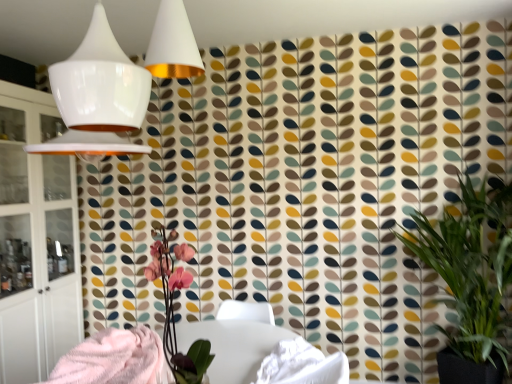
What do you see at coordinates (97, 96) in the screenshot? I see `white glossy lampshade at upper left` at bounding box center [97, 96].

Where is `white glass cabinet at left`? Image resolution: width=512 pixels, height=384 pixels. white glass cabinet at left is located at coordinates (36, 241).

Find the location of a particular element. The width and height of the screenshot is (512, 384). white glossy lampshade at upper left is located at coordinates (97, 96).

Between pink matte orchid at center and white glossy lampshade at upper left, which one has smaller size?

With smaller size is pink matte orchid at center.

Identify the location of floral arrangement lying on the right of white glossy lampshade at upper left. This screenshot has height=384, width=512. (172, 306).

Looking at this image, from a real-world perspective, which object stands above the other?

From a 3D spatial view, white glossy lampshade at upper left is above.

In the image, is pink matte orchid at center positioned in front of or behind white glossy lampshade at upper left?

Clearly, pink matte orchid at center is behind white glossy lampshade at upper left.

Considering the sizes of fluffy pink blanket at lower left and pink matte orchid at center in the image, is fluffy pink blanket at lower left wider or thinner than pink matte orchid at center?

Considering their sizes, fluffy pink blanket at lower left looks broader than pink matte orchid at center.

Can you tell me how much fluffy pink blanket at lower left and pink matte orchid at center differ in facing direction?

179 degrees separate the facing orientations of fluffy pink blanket at lower left and pink matte orchid at center.

Visually, is fluffy pink blanket at lower left positioned to the left or to the right of pink matte orchid at center?

fluffy pink blanket at lower left is positioned on pink matte orchid at center's left side.

Is white glossy table at center positioned in front of pink matte orchid at center?

No.

Is white glossy table at center positioned far away from pink matte orchid at center?

white glossy table at center is near pink matte orchid at center, not far away.

Can we say white glossy table at center lies outside pink matte orchid at center?

Absolutely, white glossy table at center is external to pink matte orchid at center.

Between white glossy table at center and pink matte orchid at center, which one has less height?

Standing shorter between the two is white glossy table at center.

Identify the location of lamp that is above the white glass cabinet at left (from the image's perspective). (97, 96).

Considering the relative sizes of white glass cabinet at left and white glossy lampshade at upper left in the image provided, is white glass cabinet at left taller than white glossy lampshade at upper left?

Yes, white glass cabinet at left is taller than white glossy lampshade at upper left.

Which object is positioned more to the left, white glass cabinet at left or white glossy lampshade at upper left?

Positioned to the left is white glass cabinet at left.

Between white glass cabinet at left and white glossy lampshade at upper left, which one has larger width?

white glossy lampshade at upper left is wider.

Is point (173, 322) behind point (246, 354)?

That is False.

From a real-world perspective, is pink matte orchid at center on top of white glossy table at center?

Indeed, from a real-world perspective, pink matte orchid at center stands above white glossy table at center.

At what (x,y) coordinates should I click in order to perform the action: click on floral arrangement that is in front of the white glossy table at center. Please return your answer as a coordinate pair (x, y). This screenshot has width=512, height=384. Looking at the image, I should click on (172, 306).

Considering the positions of point (486, 363) and point (46, 102), is point (486, 363) closer or farther from the camera than point (46, 102)?

Point (486, 363) is closer to the camera than point (46, 102).

Does green leafy plant at right touch white glass cabinet at left?

No.

From the image's perspective, between green leafy plant at right and white glass cabinet at left, which one is located above?

From the image's view, white glass cabinet at left is above.

In the scene shown: Is white glass cabinet at left inside green leafy plant at right?

No.

From their relative heights in the image, would you say white glossy table at center is taller or shorter than fluffy pink blanket at lower left?

In the image, white glossy table at center appears to be taller than fluffy pink blanket at lower left.

From a real-world perspective, who is located lower, white glossy table at center or fluffy pink blanket at lower left?

In real-world perspective, white glossy table at center is lower.

Could you tell me if white glossy table at center is facing fluffy pink blanket at lower left?

Yes, white glossy table at center is turned towards fluffy pink blanket at lower left.

In order to click on floral arrangement behind the white glossy lampshade at upper left in this screenshot , I will do `click(172, 306)`.

The image size is (512, 384). Identify the location of blanket below the pink matte orchid at center (from a real-world perspective). (113, 358).

When comparing their distances from green leafy plant at right, does pink matte orchid at center or white glossy table at center seem closer?

The object closer to green leafy plant at right is white glossy table at center.

Which object lies further to the anchor point white glossy lampshade at upper left, green leafy plant at right or white glossy table at center?

The object further to white glossy lampshade at upper left is green leafy plant at right.

When comparing their distances from fluffy pink blanket at lower left, does pink matte orchid at center or white glass cabinet at left seem closer?

The object closer to fluffy pink blanket at lower left is pink matte orchid at center.

Estimate the real-world distances between objects in this image. Which object is further from white glass cabinet at left, green leafy plant at right or white glossy table at center?

green leafy plant at right is further to white glass cabinet at left.

Looking at this image, which object lies nearer to the anchor point green leafy plant at right, pink matte orchid at center or fluffy pink blanket at lower left?

pink matte orchid at center lies closer to green leafy plant at right than the other object.

From the image, which object appears to be farther from green leafy plant at right, pink matte orchid at center or white glass cabinet at left?

The object further to green leafy plant at right is white glass cabinet at left.

Looking at the image, which one is located closer to green leafy plant at right, white glossy table at center or white glass cabinet at left?

white glossy table at center is positioned closer to the anchor green leafy plant at right.

Which object lies further to the anchor point pink matte orchid at center, white glossy lampshade at upper left or green leafy plant at right?

Based on the image, green leafy plant at right appears to be further to pink matte orchid at center.

Locate an element on the screen. round table situated between white glass cabinet at left and green leafy plant at right from left to right is located at coordinates (233, 346).

This screenshot has width=512, height=384. In order to click on floral arrangement between white glossy lampshade at upper left and white glass cabinet at left in the front-back direction in this screenshot , I will do `click(172, 306)`.

I want to click on blanket between white glass cabinet at left and white glossy table at center from left to right, so click(113, 358).

Where is `floral arrangement between white glass cabinet at left and white glossy table at center in the horizontal direction`? The width and height of the screenshot is (512, 384). floral arrangement between white glass cabinet at left and white glossy table at center in the horizontal direction is located at coordinates (172, 306).